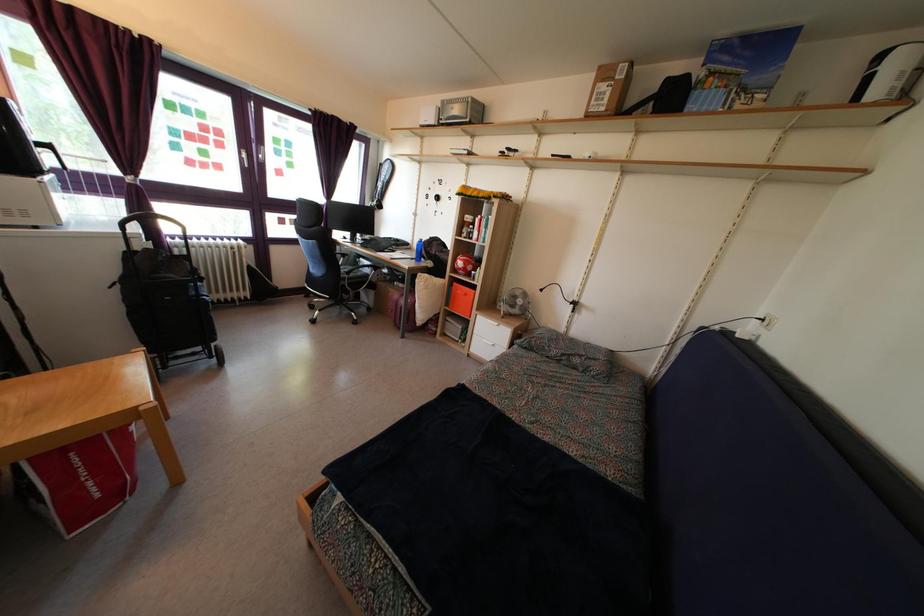
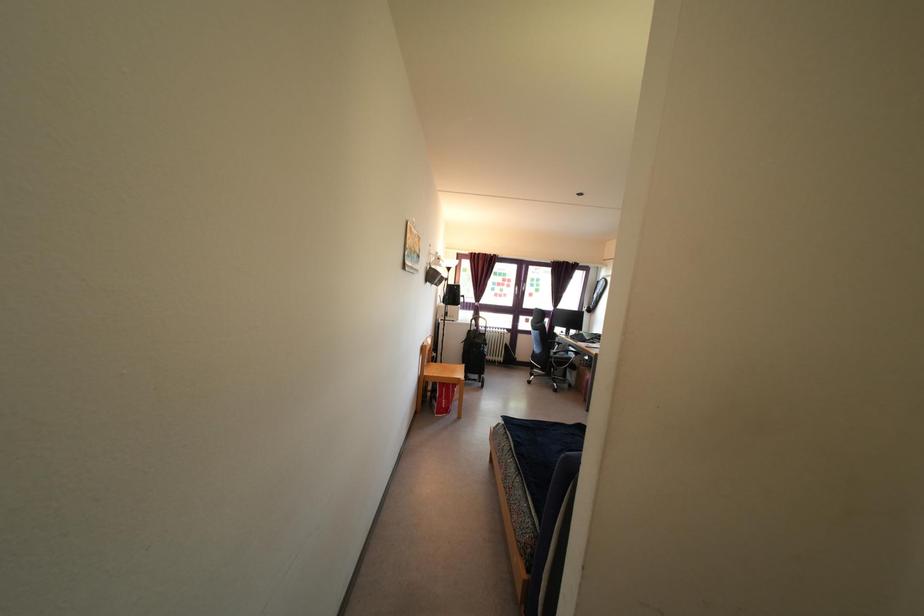
The point at (132, 262) is marked in the first image. Where is the corresponding point in the second image?

(472, 339)